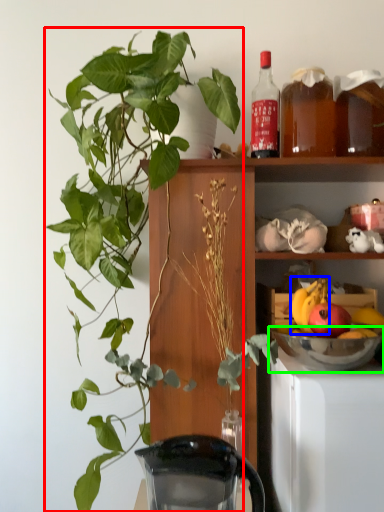
Question: Which object is the closest to the houseplant (highlighted by a red box)? Choose among these: fruit (highlighted by a blue box) or mixing bowl (highlighted by a green box).

Choices:
 (A) fruit
 (B) mixing bowl

Answer: (B)